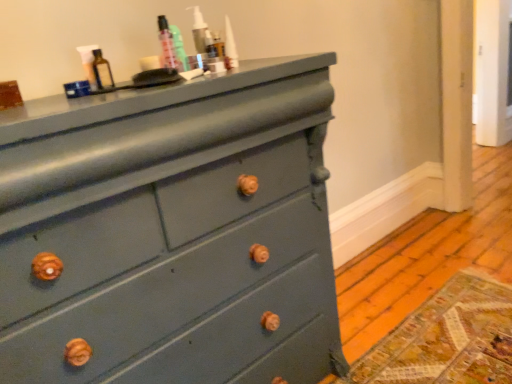
Question: From the image's perspective, is teal glossy bottle at upper center located above or below matte glass bottle at upper center?

Choices:
 (A) above
 (B) below

Answer: (A)

Question: Looking at their shapes, would you say teal glossy bottle at upper center is wider or thinner than matte glass bottle at upper center?

Choices:
 (A) thin
 (B) wide

Answer: (A)

Question: Based on their relative distances, which object is farther from the matte glass bottle at upper center?

Choices:
 (A) teal glossy bottle at upper center
 (B) matte teal dresser at center

Answer: (B)

Question: Estimate the real-world distances between objects in this image. Which object is farther from the teal glossy bottle at upper center?

Choices:
 (A) matte glass bottle at upper center
 (B) matte teal dresser at center

Answer: (B)